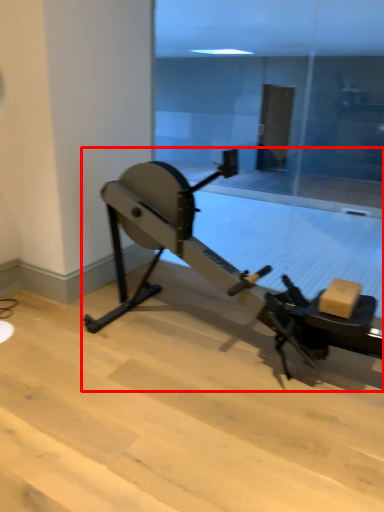
Question: In this image, where is stationary bicycle (annotated by the red box) located relative to glass door?

Choices:
 (A) left
 (B) right

Answer: (A)